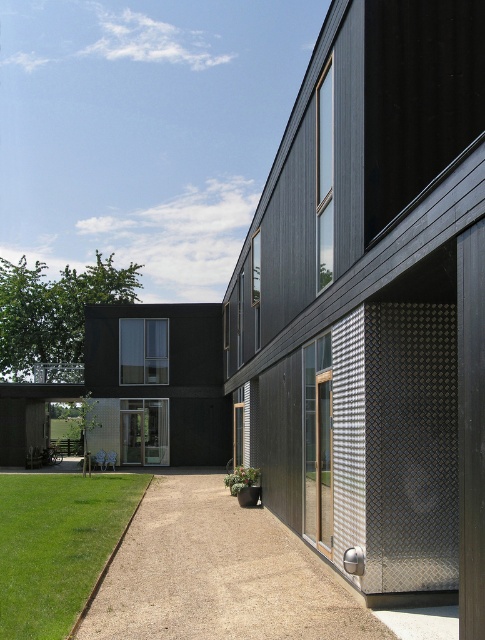
Question: Is smooth gravel driveway at center below green grass at lower left?

Choices:
 (A) yes
 (B) no

Answer: (B)

Question: Is smooth gravel driveway at center to the left of green grass at lower left from the viewer's perspective?

Choices:
 (A) no
 (B) yes

Answer: (A)

Question: Does smooth gravel driveway at center appear on the left side of green grass at lower left?

Choices:
 (A) yes
 (B) no

Answer: (B)